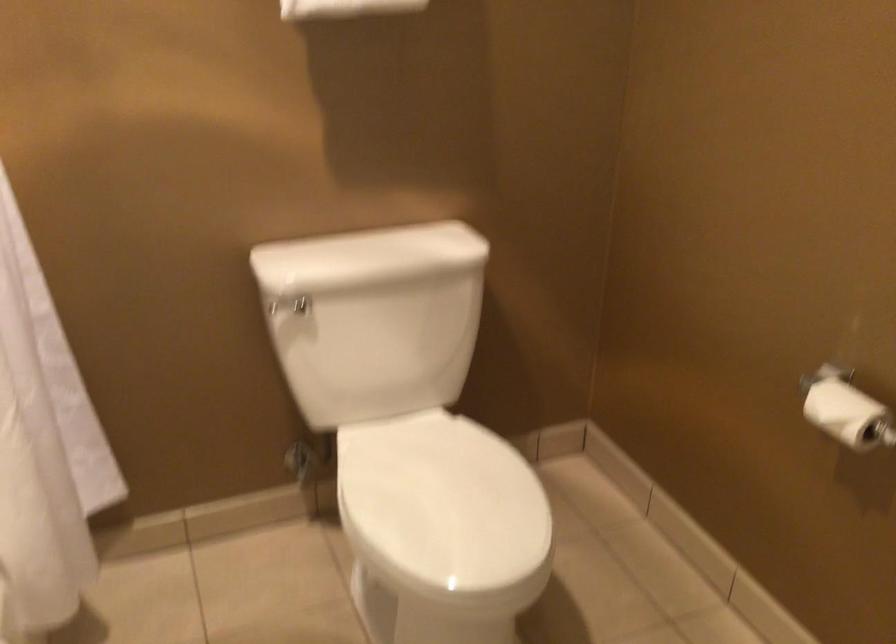
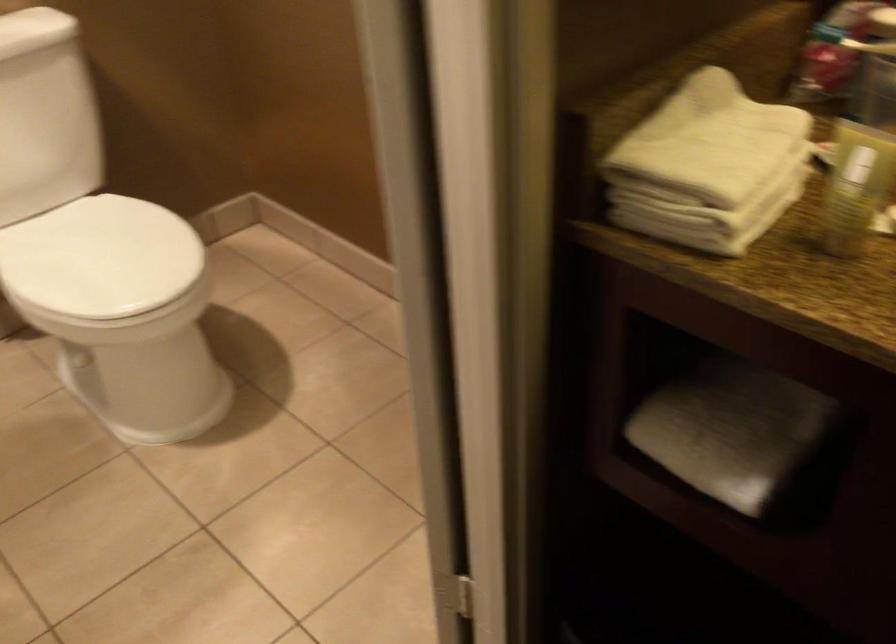
Question: The camera is either moving clockwise (left) or counter-clockwise (right) around the object. The first image is from the beginning of the video and the second image is from the end. Is the camera moving left or right when shooting the video?

Choices:
 (A) Left
 (B) Right

Answer: (A)